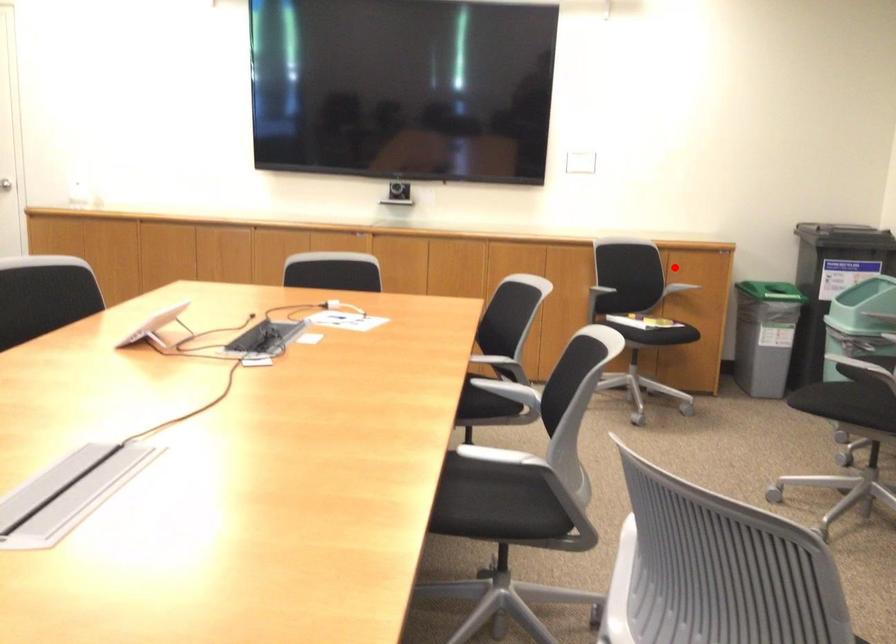
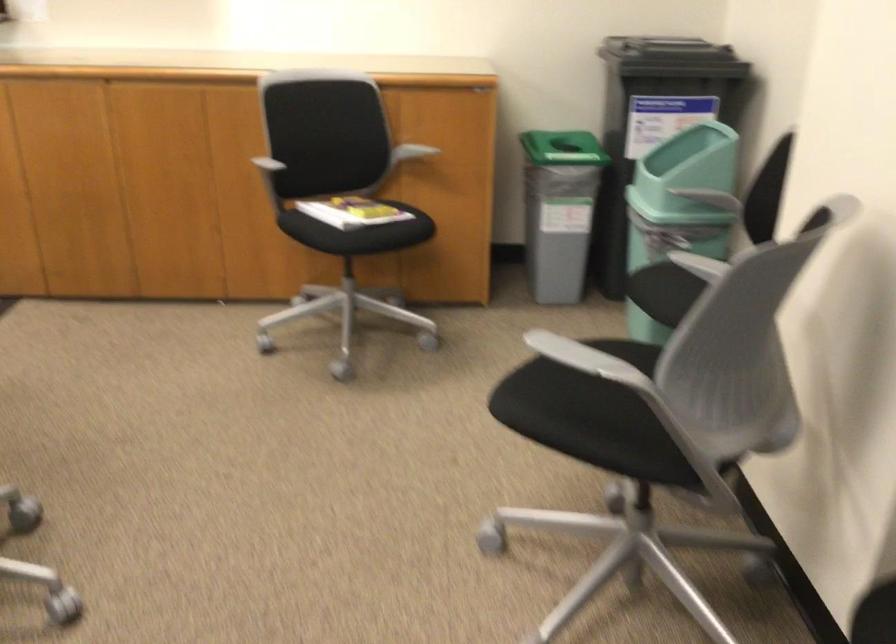
The point at the highlighted location is marked in the first image. Where is the corresponding point in the second image?

(409, 152)